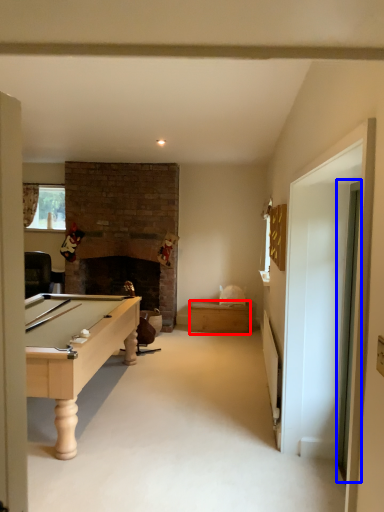
Question: Among these objects, which one is farthest to the camera, drawer (highlighted by a red box) or glass door (highlighted by a blue box)?

Choices:
 (A) drawer
 (B) glass door

Answer: (A)